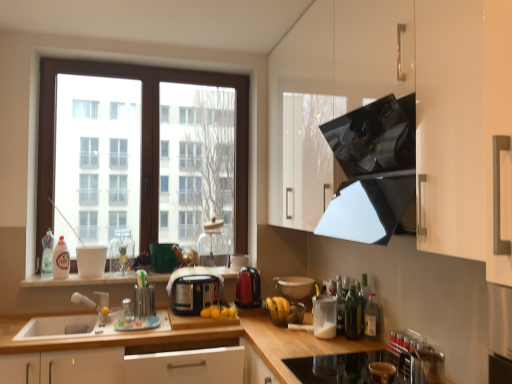
You are a GUI agent. You are given a task and a screenshot of the screen. Output one action in this format:
    pyautogui.click(x=<x>, y=<y>)
    Task: Click on the free space in front of green glass bottle at lower right, the fourth bottle viewed from the back
    The height and width of the screenshot is (384, 512).
    Given the screenshot: What is the action you would take?
    pyautogui.click(x=356, y=347)